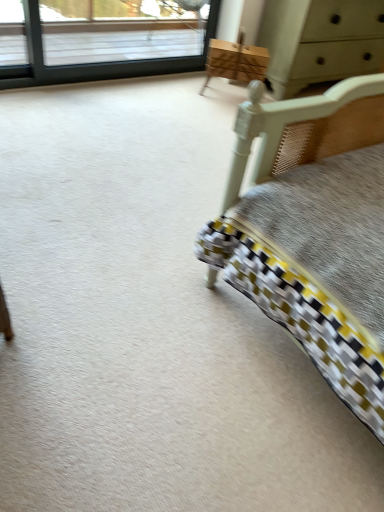
Question: Considering the positions of wooden chest of drawers at upper center and light gray wood dresser at upper right in the image, is wooden chest of drawers at upper center wider or thinner than light gray wood dresser at upper right?

Choices:
 (A) wide
 (B) thin

Answer: (B)

Question: In the image, is wooden chest of drawers at upper center positioned in front of or behind light gray wood dresser at upper right?

Choices:
 (A) behind
 (B) front

Answer: (A)

Question: Based on their relative distances, which object is nearer to the clear glass window at upper left?

Choices:
 (A) light gray wood dresser at upper right
 (B) wooden chest of drawers at upper center

Answer: (B)

Question: Which object is the farthest from the wooden chest of drawers at upper center?

Choices:
 (A) clear glass window at upper left
 (B) light gray wood dresser at upper right

Answer: (A)